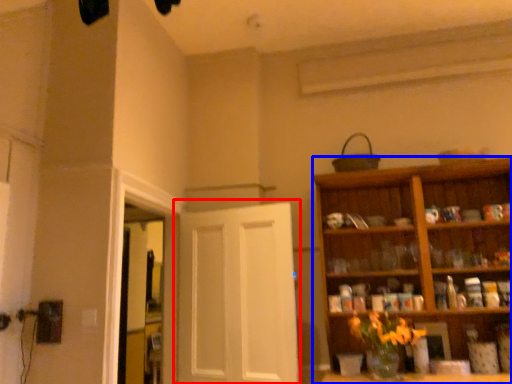
Question: Which object is closer to the camera taking this photo, door (highlighted by a red box) or cabinetry (highlighted by a blue box)?

Choices:
 (A) door
 (B) cabinetry

Answer: (B)